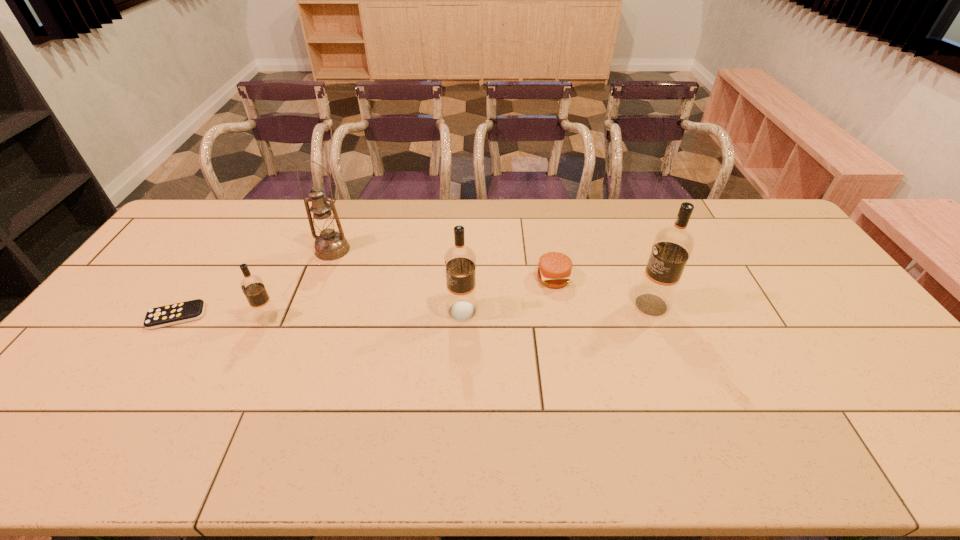
The height and width of the screenshot is (540, 960). What are the coordinates of `vacant space situated on the right of the farthest object` in the screenshot? It's located at (439, 249).

You are a GUI agent. You are given a task and a screenshot of the screen. Output one action in this format:
    pyautogui.click(x=<x>, y=<y>)
    Task: Click on the free space located on the front of the fifth tallest object
    
    Given the screenshot: What is the action you would take?
    pyautogui.click(x=571, y=379)

Locate an element on the screen. vacant point located 0.090m on the front of the remote control is located at coordinates tap(150, 357).

Locate an element on the screen. This screenshot has width=960, height=540. object located at the left edge is located at coordinates (182, 312).

This screenshot has width=960, height=540. Identify the location of free spot at the far edge of the desktop. [x=449, y=205].

Image resolution: width=960 pixels, height=540 pixels. I want to click on free spot at the near edge of the desktop, so click(253, 387).

Where is `free space at the far left corner of the desktop`? free space at the far left corner of the desktop is located at coordinates (178, 227).

Identify the location of vacant space at the near left corner. This screenshot has width=960, height=540. (98, 392).

Where is `blank area at the far right corner`? blank area at the far right corner is located at coordinates (756, 213).

Find the location of a particular element. free space between the second shortest object and the second vodka from right to left is located at coordinates (508, 295).